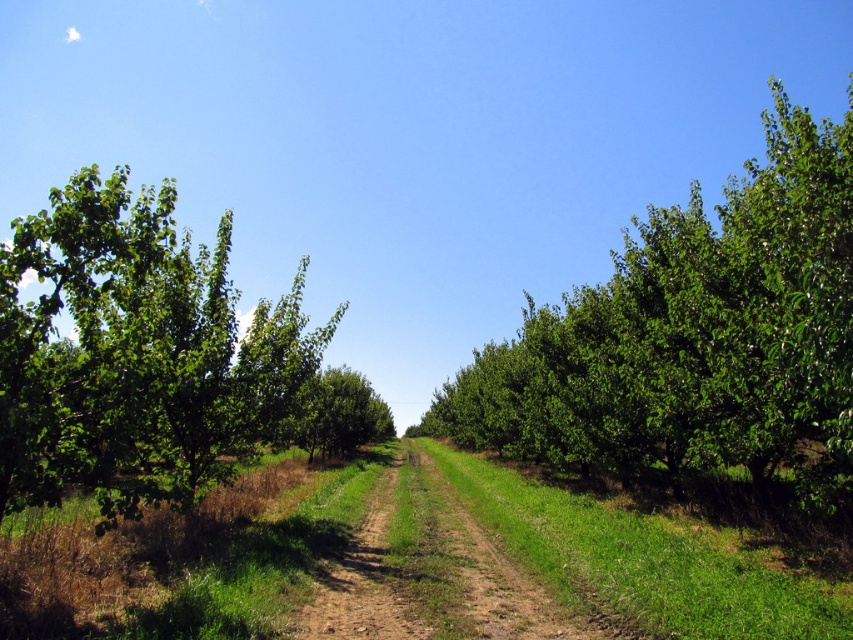
You are standing on the brown dirt track at center and want to walk to the green leafy tree at left. Which direction should you face before starting to walk?

You should face to the left because the green leafy tree at left is to the left of brown dirt track at center.

You are walking along the dirt path in the orchard and want to reach the green leafy tree at left. Which direction should you move relative to the green leafy tree at center?

To reach the green leafy tree at left, you should move towards the left side of the green leafy tree at center, as the tree at left is closer to you than the one at center.